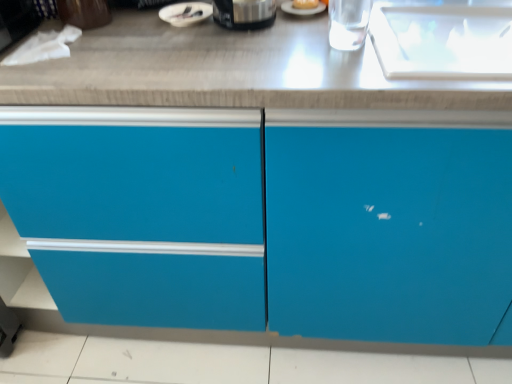
How much space does satin black coffee maker at upper center, the 1th appliance when ordered from right to left, occupy horizontally?

The width of satin black coffee maker at upper center, the 1th appliance when ordered from right to left, is 8.01 inches.

Identify the location of white glossy bowl at upper center, marked as the 1th appliance in a left-to-right arrangement. This screenshot has height=384, width=512. (185, 13).

From the image's perspective, between white glossy bowl at upper center, marked as the 1th appliance in a left-to-right arrangement, and golden bread at center, who is located below?

white glossy bowl at upper center, marked as the 1th appliance in a left-to-right arrangement, from the image's perspective.

Does white glossy bowl at upper center, placed as the 2th appliance when sorted from right to left, come in front of golden bread at center?

Yes, it is.

Who is taller, white glossy bowl at upper center, marked as the 1th appliance in a left-to-right arrangement, or golden bread at center?

golden bread at center is taller.

From a real-world perspective, is white glossy bowl at upper center, marked as the 1th appliance in a left-to-right arrangement, physically below golden bread at center?

Yes.

Is satin black coffee maker at upper center, the 2th appliance positioned from the left, placed right next to white glossy bowl at upper center, marked as the 1th appliance in a left-to-right arrangement?

satin black coffee maker at upper center, the 2th appliance positioned from the left, and white glossy bowl at upper center, marked as the 1th appliance in a left-to-right arrangement, are not in contact.

From a real-world perspective, is satin black coffee maker at upper center, the 2th appliance positioned from the left, on top of white glossy bowl at upper center, placed as the 2th appliance when sorted from right to left?

Indeed, from a real-world perspective, satin black coffee maker at upper center, the 2th appliance positioned from the left, stands above white glossy bowl at upper center, placed as the 2th appliance when sorted from right to left.

Can you confirm if satin black coffee maker at upper center, the 1th appliance when ordered from right to left, is bigger than white glossy bowl at upper center, placed as the 2th appliance when sorted from right to left?

Yes.

Is satin black coffee maker at upper center, the 2th appliance positioned from the left, thinner than golden bread at center?

In fact, satin black coffee maker at upper center, the 2th appliance positioned from the left, might be wider than golden bread at center.

From the image's perspective, relative to golden bread at center, is satin black coffee maker at upper center, the 1th appliance when ordered from right to left, above or below?

Clearly, from the image's perspective, satin black coffee maker at upper center, the 1th appliance when ordered from right to left, is below golden bread at center.

Which of these two, satin black coffee maker at upper center, the 2th appliance positioned from the left, or golden bread at center, is smaller?

Smaller between the two is golden bread at center.

How many degrees apart are the facing directions of golden bread at center and matte blue cabinet at center?

They differ by 2.63 degrees in their facing directions.

Between golden bread at center and matte blue cabinet at center, which one has smaller width?

golden bread at center.

Is golden bread at center oriented towards matte blue cabinet at center?

No, golden bread at center does not turn towards matte blue cabinet at center.

At what (x,y) coordinates should I click in order to perform the action: click on cabinetry below the golden bread at center (from the image's perspective). Please return your answer as a coordinate pair (x, y). This screenshot has width=512, height=384. Looking at the image, I should click on (291, 208).

Can you confirm if golden bread at center is smaller than satin black coffee maker at upper center, the 2th appliance positioned from the left?

Yes.

Is point (316, 1) more distant than point (252, 2)?

Yes, it is behind point (252, 2).

Can you confirm if golden bread at center is positioned to the right of satin black coffee maker at upper center, the 1th appliance when ordered from right to left?

Yes.

Which of these two, golden bread at center or satin black coffee maker at upper center, the 1th appliance when ordered from right to left, is wider?

satin black coffee maker at upper center, the 1th appliance when ordered from right to left, is wider.

Is golden bread at center spatially inside white glossy bowl at upper center, placed as the 2th appliance when sorted from right to left, or outside of it?

golden bread at center is located beyond the bounds of white glossy bowl at upper center, placed as the 2th appliance when sorted from right to left.

Between golden bread at center and white glossy bowl at upper center, placed as the 2th appliance when sorted from right to left, which one has smaller size?

golden bread at center.

Considering the relative positions of golden bread at center and white glossy bowl at upper center, placed as the 2th appliance when sorted from right to left, in the image provided, is golden bread at center to the left or to the right of white glossy bowl at upper center, placed as the 2th appliance when sorted from right to left,?

From the image, it's evident that golden bread at center is to the right of white glossy bowl at upper center, placed as the 2th appliance when sorted from right to left.

In the scene shown: Is golden bread at center in front of or behind white glossy bowl at upper center, marked as the 1th appliance in a left-to-right arrangement, in the image?

golden bread at center is behind white glossy bowl at upper center, marked as the 1th appliance in a left-to-right arrangement.

At what (x,y) coordinates should I click in order to perform the action: click on the 1st appliance above when counting from the matte blue cabinet at center (from the image's perspective). Please return your answer as a coordinate pair (x, y). Looking at the image, I should click on click(244, 13).

Based on the photo, visually, is matte blue cabinet at center positioned to the left or to the right of satin black coffee maker at upper center, the 2th appliance positioned from the left?

In the image, matte blue cabinet at center appears on the right side of satin black coffee maker at upper center, the 2th appliance positioned from the left.

Does matte blue cabinet at center turn towards satin black coffee maker at upper center, the 1th appliance when ordered from right to left?

No, matte blue cabinet at center is not aimed at satin black coffee maker at upper center, the 1th appliance when ordered from right to left.

From a real-world perspective, is matte blue cabinet at center under satin black coffee maker at upper center, the 2th appliance positioned from the left?

Yes, from a real-world perspective, matte blue cabinet at center is below satin black coffee maker at upper center, the 2th appliance positioned from the left.

Where is `food above the white glossy bowl at upper center, placed as the 2th appliance when sorted from right to left (from a real-world perspective)`? This screenshot has width=512, height=384. food above the white glossy bowl at upper center, placed as the 2th appliance when sorted from right to left (from a real-world perspective) is located at coordinates (305, 4).

Where is `appliance above the satin black coffee maker at upper center, the 2th appliance positioned from the left (from the image's perspective)`? The height and width of the screenshot is (384, 512). appliance above the satin black coffee maker at upper center, the 2th appliance positioned from the left (from the image's perspective) is located at coordinates (185, 13).

When comparing their distances from matte blue cabinet at center, does golden bread at center or white glossy bowl at upper center, marked as the 1th appliance in a left-to-right arrangement, seem closer?

white glossy bowl at upper center, marked as the 1th appliance in a left-to-right arrangement, is closer to matte blue cabinet at center.

From the picture: Considering their positions, is matte blue cabinet at center positioned further to golden bread at center than white glossy bowl at upper center, marked as the 1th appliance in a left-to-right arrangement?

matte blue cabinet at center is further to golden bread at center.

When comparing their distances from matte blue cabinet at center, does satin black coffee maker at upper center, the 2th appliance positioned from the left, or white glossy bowl at upper center, marked as the 1th appliance in a left-to-right arrangement, seem further?

white glossy bowl at upper center, marked as the 1th appliance in a left-to-right arrangement, is positioned further to the anchor matte blue cabinet at center.

Considering their positions, is golden bread at center positioned further to satin black coffee maker at upper center, the 1th appliance when ordered from right to left, than white glossy bowl at upper center, placed as the 2th appliance when sorted from right to left?

golden bread at center.

When comparing their distances from white glossy bowl at upper center, placed as the 2th appliance when sorted from right to left, does satin black coffee maker at upper center, the 1th appliance when ordered from right to left, or golden bread at center seem closer?

satin black coffee maker at upper center, the 1th appliance when ordered from right to left, is positioned closer to the anchor white glossy bowl at upper center, placed as the 2th appliance when sorted from right to left.

Which object lies further to the anchor point satin black coffee maker at upper center, the 1th appliance when ordered from right to left, golden bread at center or matte blue cabinet at center?

Based on the image, matte blue cabinet at center appears to be further to satin black coffee maker at upper center, the 1th appliance when ordered from right to left.

Estimate the real-world distances between objects in this image. Which object is closer to matte blue cabinet at center, golden bread at center or satin black coffee maker at upper center, the 1th appliance when ordered from right to left?

Among the two, satin black coffee maker at upper center, the 1th appliance when ordered from right to left, is located nearer to matte blue cabinet at center.

From the image, which object appears to be nearer to white glossy bowl at upper center, placed as the 2th appliance when sorted from right to left, golden bread at center or matte blue cabinet at center?

Based on the image, golden bread at center appears to be nearer to white glossy bowl at upper center, placed as the 2th appliance when sorted from right to left.

This screenshot has width=512, height=384. I want to click on appliance between white glossy bowl at upper center, placed as the 2th appliance when sorted from right to left, and golden bread at center, so click(244, 13).

Where is `appliance that lies between white glossy bowl at upper center, placed as the 2th appliance when sorted from right to left, and matte blue cabinet at center from top to bottom`? The height and width of the screenshot is (384, 512). appliance that lies between white glossy bowl at upper center, placed as the 2th appliance when sorted from right to left, and matte blue cabinet at center from top to bottom is located at coordinates (244, 13).